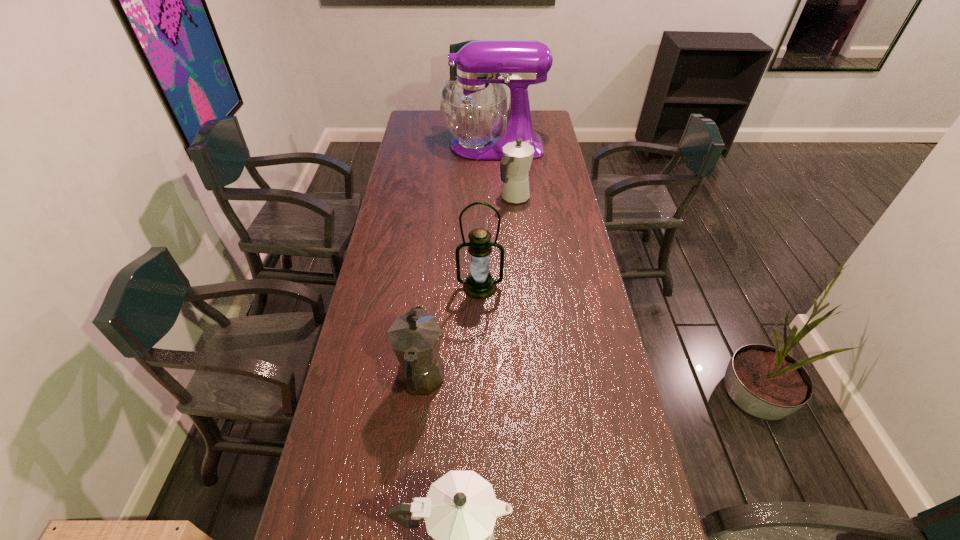
Locate an element on the screen. This screenshot has width=960, height=540. the tallest object is located at coordinates (473, 107).

You are a GUI agent. You are given a task and a screenshot of the screen. Output one action in this format:
    pyautogui.click(x=<x>, y=<y>)
    Task: Click on the mixer
    The width and height of the screenshot is (960, 540).
    Given the screenshot: What is the action you would take?
    pyautogui.click(x=473, y=107)

You are a GUI agent. You are given a task and a screenshot of the screen. Output one action in this format:
    pyautogui.click(x=<x>, y=<y>)
    Task: Click on the lantern
    The height and width of the screenshot is (540, 960).
    Given the screenshot: What is the action you would take?
    pyautogui.click(x=479, y=284)

This screenshot has width=960, height=540. I want to click on the third nearest object, so click(479, 284).

You are a GUI agent. You are given a task and a screenshot of the screen. Output one action in this format:
    pyautogui.click(x=<x>, y=<y>)
    Task: Click on the farthest coffeepot
    
    Given the screenshot: What is the action you would take?
    pyautogui.click(x=514, y=167)

Find the location of `the fourth nearest object`. the fourth nearest object is located at coordinates (514, 167).

The image size is (960, 540). I want to click on the second farthest coffeepot, so click(x=415, y=337).

You are a GUI agent. You are given a task and a screenshot of the screen. Output one action in this format:
    pyautogui.click(x=<x>, y=<y>)
    Task: Click on the vacant area situated 0.200m at the bowl opening of the farthest object
    This screenshot has height=540, width=960.
    Given the screenshot: What is the action you would take?
    pyautogui.click(x=402, y=146)

Where is `blank space located at the bowl opening of the farthest object`? The height and width of the screenshot is (540, 960). blank space located at the bowl opening of the farthest object is located at coordinates (433, 146).

Image resolution: width=960 pixels, height=540 pixels. I want to click on vacant position located 0.170m at the bowl opening of the farthest object, so click(x=408, y=146).